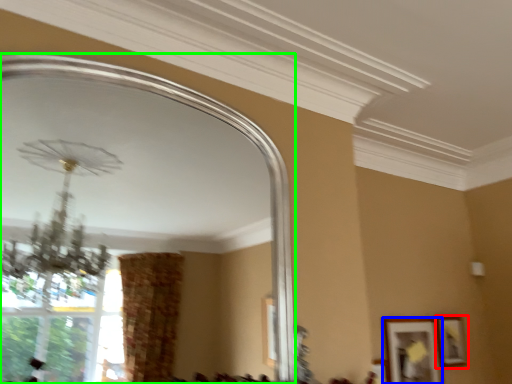
Question: Which object is the closest to the picture frame (highlighted by a red box)? Choose among these: picture frame (highlighted by a blue box) or mirror (highlighted by a green box).

Choices:
 (A) picture frame
 (B) mirror

Answer: (A)